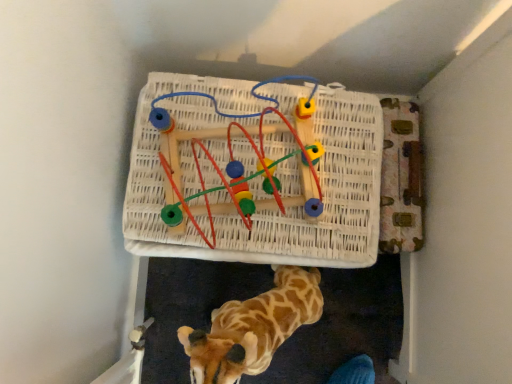
Question: Could you tell me if woven wood maze at upper center is facing spotted plush giraffe at lower center?

Choices:
 (A) no
 (B) yes

Answer: (B)

Question: Are woven wood maze at upper center and spotted plush giraffe at lower center making contact?

Choices:
 (A) no
 (B) yes

Answer: (A)

Question: Is woven wood maze at upper center not inside spotted plush giraffe at lower center?

Choices:
 (A) yes
 (B) no

Answer: (A)

Question: Is woven wood maze at upper center to the left of spotted plush giraffe at lower center from the viewer's perspective?

Choices:
 (A) no
 (B) yes

Answer: (B)

Question: From a real-world perspective, is woven wood maze at upper center physically below spotted plush giraffe at lower center?

Choices:
 (A) yes
 (B) no

Answer: (B)

Question: Considering the relative sizes of woven wood maze at upper center and spotted plush giraffe at lower center in the image provided, is woven wood maze at upper center taller than spotted plush giraffe at lower center?

Choices:
 (A) no
 (B) yes

Answer: (A)

Question: Is spotted plush giraffe at lower center in contact with woven wood maze at upper center?

Choices:
 (A) no
 (B) yes

Answer: (A)

Question: Considering the relative sizes of spotted plush giraffe at lower center and woven wood maze at upper center in the image provided, is spotted plush giraffe at lower center thinner than woven wood maze at upper center?

Choices:
 (A) yes
 (B) no

Answer: (A)

Question: Is spotted plush giraffe at lower center closer to the viewer compared to woven wood maze at upper center?

Choices:
 (A) yes
 (B) no

Answer: (A)

Question: From the image's perspective, is spotted plush giraffe at lower center on woven wood maze at upper center?

Choices:
 (A) yes
 (B) no

Answer: (B)

Question: Could you tell me if spotted plush giraffe at lower center is facing woven wood maze at upper center?

Choices:
 (A) no
 (B) yes

Answer: (A)

Question: Does spotted plush giraffe at lower center have a lesser height compared to woven wood maze at upper center?

Choices:
 (A) no
 (B) yes

Answer: (A)

Question: Considering the positions of point (220, 382) and point (297, 203), is point (220, 382) closer or farther from the camera than point (297, 203)?

Choices:
 (A) farther
 (B) closer

Answer: (B)